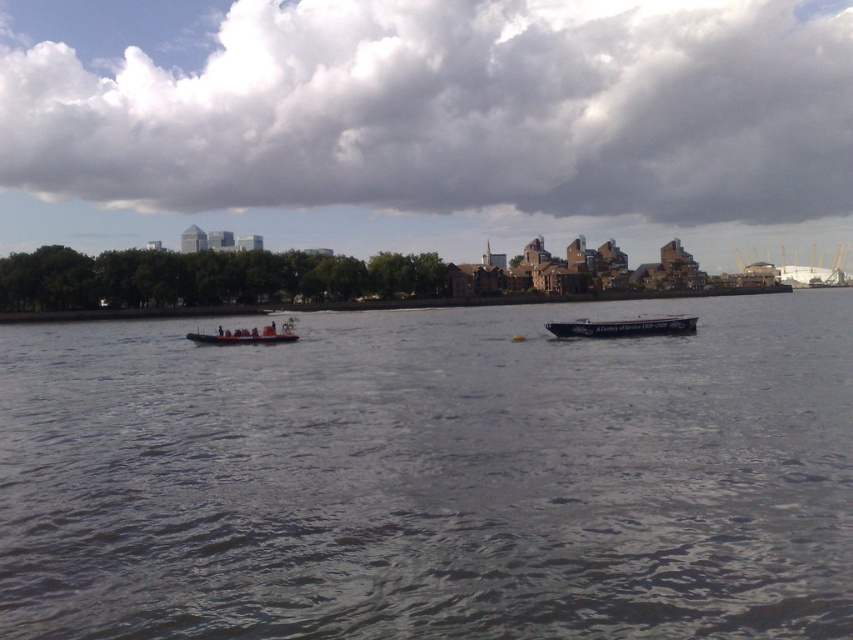
Is dark gray water at center to the right of blue painted wooden boat at center from the viewer's perspective?

Incorrect, dark gray water at center is not on the right side of blue painted wooden boat at center.

Is dark gray water at center to the left of blue painted wooden boat at center from the viewer's perspective?

Yes, dark gray water at center is to the left of blue painted wooden boat at center.

Which is behind, point (663, 401) or point (602, 330)?

Positioned behind is point (602, 330).

Identify the location of dark gray water at center. (432, 477).

Who is positioned more to the right, blue painted wooden boat at center or orange rubber boat at center?

Positioned to the right is blue painted wooden boat at center.

Is point (589, 324) farther from viewer compared to point (230, 330)?

That is False.

Which is behind, point (648, 333) or point (282, 337)?

Positioned behind is point (282, 337).

This screenshot has width=853, height=640. I want to click on blue painted wooden boat at center, so click(x=624, y=326).

Is point (30, 442) in front of point (276, 326)?

Yes, point (30, 442) is in front of point (276, 326).

Is point (733, 508) farther from viewer compared to point (274, 326)?

No, (733, 508) is in front of (274, 326).

This screenshot has width=853, height=640. I want to click on dark gray water at center, so click(x=432, y=477).